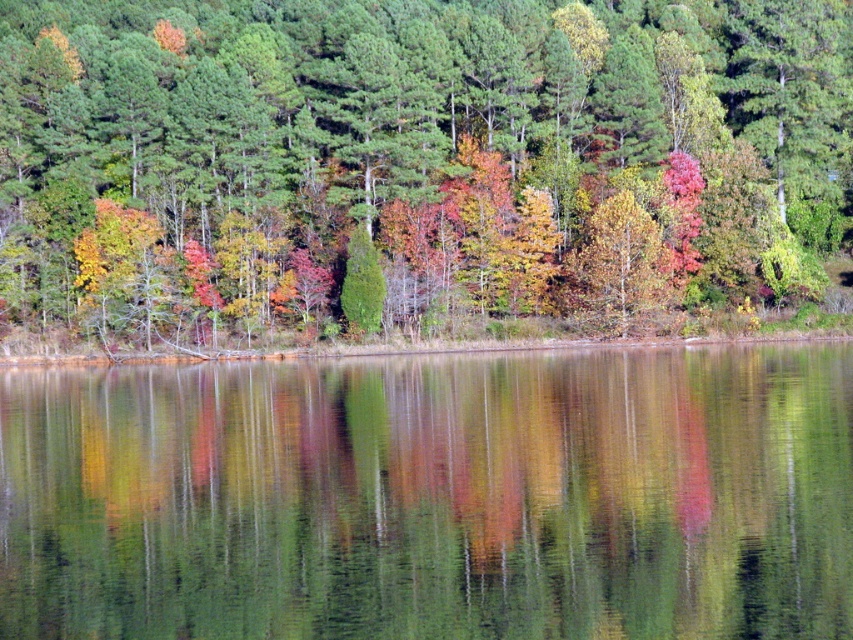
Question: Can you confirm if multicolored foliage at center is bigger than yellow-green textured tree at center?

Choices:
 (A) no
 (B) yes

Answer: (B)

Question: Based on their relative distances, which object is farther from the yellow-green textured tree at center?

Choices:
 (A) transparent water at center
 (B) multicolored foliage at center

Answer: (A)

Question: Where is multicolored foliage at center located in relation to transparent water at center in the image?

Choices:
 (A) left
 (B) right

Answer: (A)

Question: Does multicolored foliage at center appear on the right side of transparent water at center?

Choices:
 (A) yes
 (B) no

Answer: (B)

Question: Among these objects, which one is farthest from the camera?

Choices:
 (A) multicolored foliage at center
 (B) yellow-green textured tree at center

Answer: (B)

Question: Which point is farther from the camera taking this photo?

Choices:
 (A) (509, 552)
 (B) (636, 292)

Answer: (B)